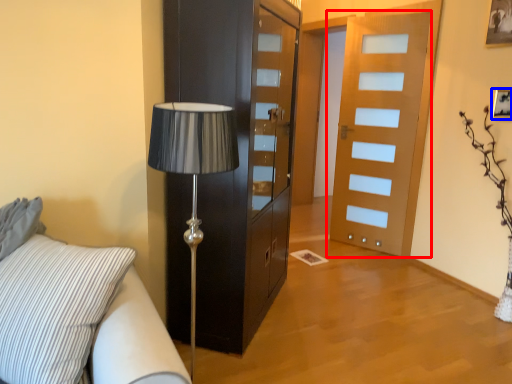
Question: Which of the following is the farthest to the observer, door (highlighted by a red box) or picture frame (highlighted by a blue box)?

Choices:
 (A) door
 (B) picture frame

Answer: (A)